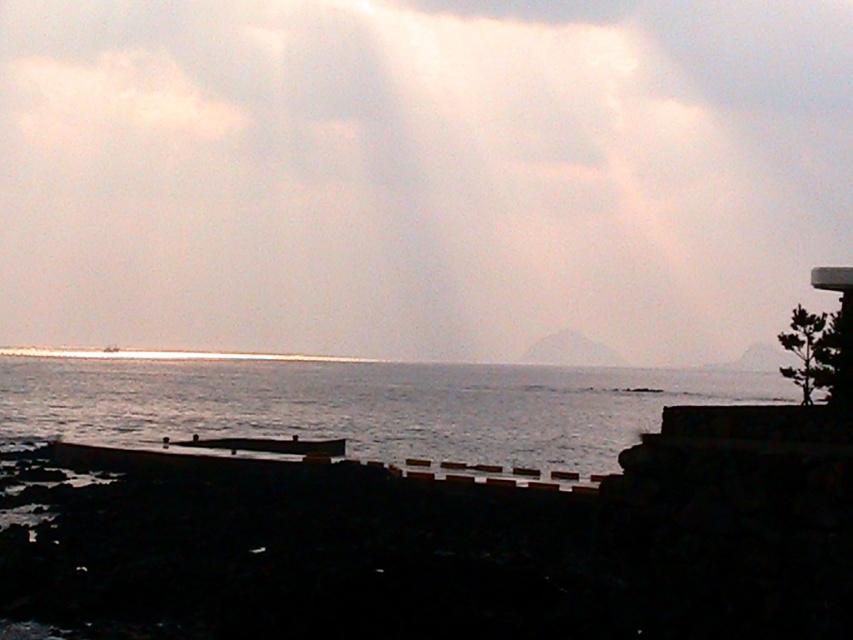
Which is more to the left, white matte cloud at upper center or silvery water at lower left?

silvery water at lower left

Is point (187, 221) more distant than point (492, 428)?

Yes, it is.

Is point (631, 77) closer to viewer compared to point (315, 408)?

That is False.

Find the location of a particular element. white matte cloud at upper center is located at coordinates (421, 172).